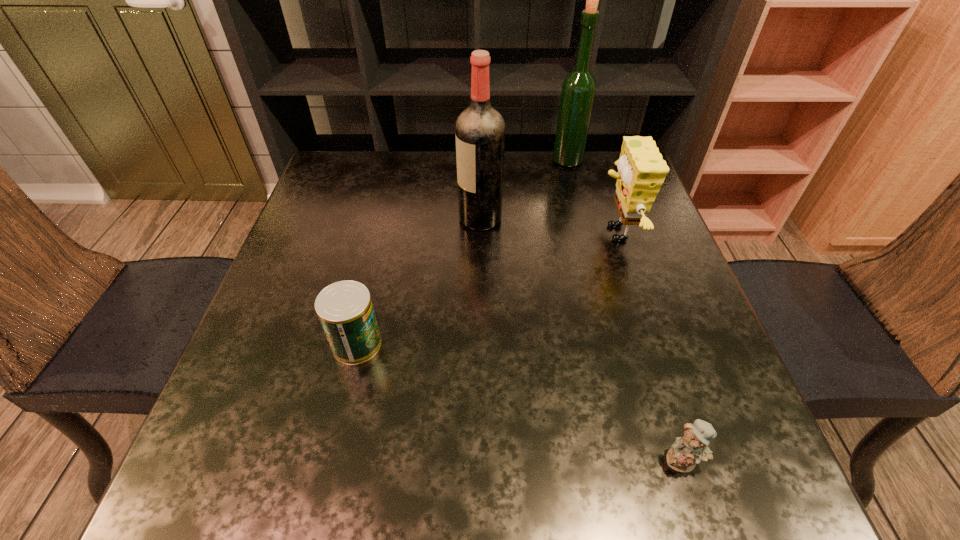
You are a GUI agent. You are given a task and a screenshot of the screen. Output one action in this format:
    pyautogui.click(x=<x>, y=<y>)
    Task: Click on the second closest object relative to the right liquor
    Image resolution: width=960 pixels, height=540 pixels.
    Given the screenshot: What is the action you would take?
    pyautogui.click(x=480, y=129)

Find the location of `object that is the closest to the sponge`. object that is the closest to the sponge is located at coordinates (578, 90).

Identify the location of vacant region that satisfies the following two spatial constraints: 1. on the front-facing side of the third shortest object; 2. on the front-facing side of the shortest object. (688, 460).

Identify the location of vacant area that satisfies the following two spatial constraints: 1. on the front side of the farthest object; 2. on the front-facing side of the nearer liquor. This screenshot has width=960, height=540. (583, 219).